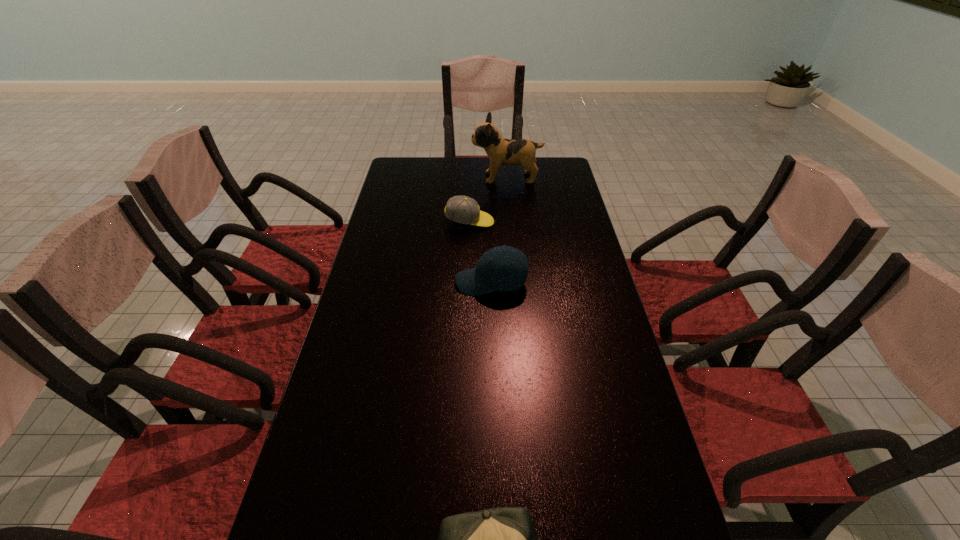
This screenshot has width=960, height=540. Find the location of `vacant point located between the puppy and the third nearest object`. vacant point located between the puppy and the third nearest object is located at coordinates (488, 200).

Find the location of a particular element. Image resolution: width=960 pixels, height=540 pixels. free space between the second tallest object and the second farthest object is located at coordinates (481, 252).

Where is `empty space between the second nearest object and the tallest object`? empty space between the second nearest object and the tallest object is located at coordinates (499, 230).

Find the location of a particular element. The height and width of the screenshot is (540, 960). unoccupied area between the farthest baseball cap and the puppy is located at coordinates (488, 200).

Where is `free spot between the second farthest baseball cap and the puppy`? free spot between the second farthest baseball cap and the puppy is located at coordinates (499, 230).

Where is `object that is the closest to the farthest baseball cap`? This screenshot has height=540, width=960. object that is the closest to the farthest baseball cap is located at coordinates (499, 150).

Identify which object is located as the third nearest to the second farthest object. Please provide its 2D coordinates. Your answer should be formatted as a tuple, i.e. [(x, y)], where the tuple contains the x and y coordinates of a point satisfying the conditions above.

[(504, 539)]

Locate an element on the screen. The width and height of the screenshot is (960, 540). baseball cap object that ranks as the third closest to the farthest object is located at coordinates [504, 539].

Identify the location of the second closest baseball cap relative to the second tallest object. This screenshot has width=960, height=540. (504, 539).